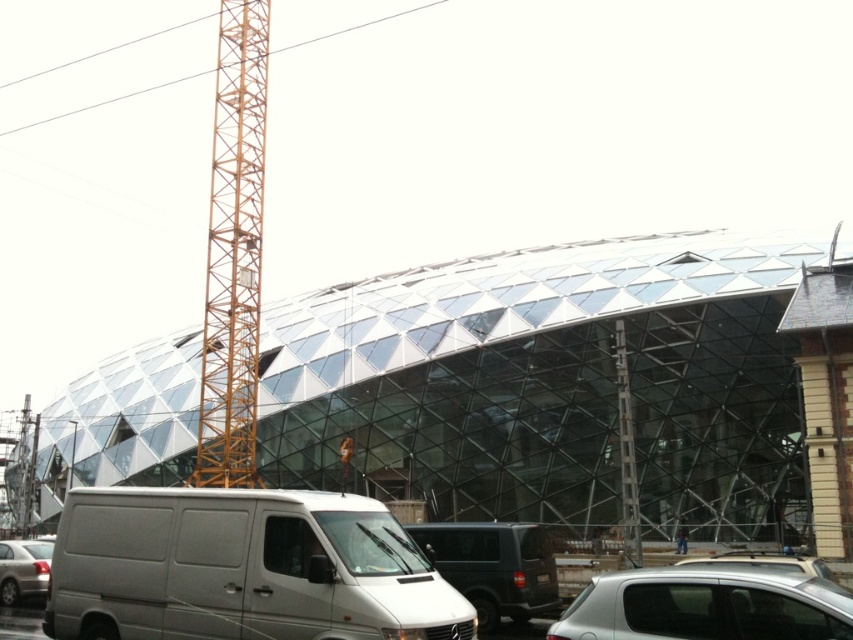
Question: Does matte black van at center have a lesser width compared to silver metallic van at lower left?

Choices:
 (A) yes
 (B) no

Answer: (B)

Question: Is yellow metal tower at left thinner than silver metallic suv at lower right?

Choices:
 (A) yes
 (B) no

Answer: (B)

Question: Which object is positioned closest to the matte black van at center?

Choices:
 (A) yellow metal tower at left
 (B) silver metallic van at lower left
 (C) transparent glass stadium at center

Answer: (B)

Question: Is matte black van at center thinner than silver metallic van at lower left?

Choices:
 (A) no
 (B) yes

Answer: (A)

Question: Based on their relative distances, which object is farther from the matte black van at center?

Choices:
 (A) silver metallic van at lower left
 (B) silver metallic suv at lower right

Answer: (A)

Question: Considering the real-world distances, which object is closest to the silver metallic suv at lower right?

Choices:
 (A) white matte van at lower left
 (B) silver metallic van at lower left
 (C) transparent glass stadium at center
 (D) yellow metal tower at left

Answer: (A)